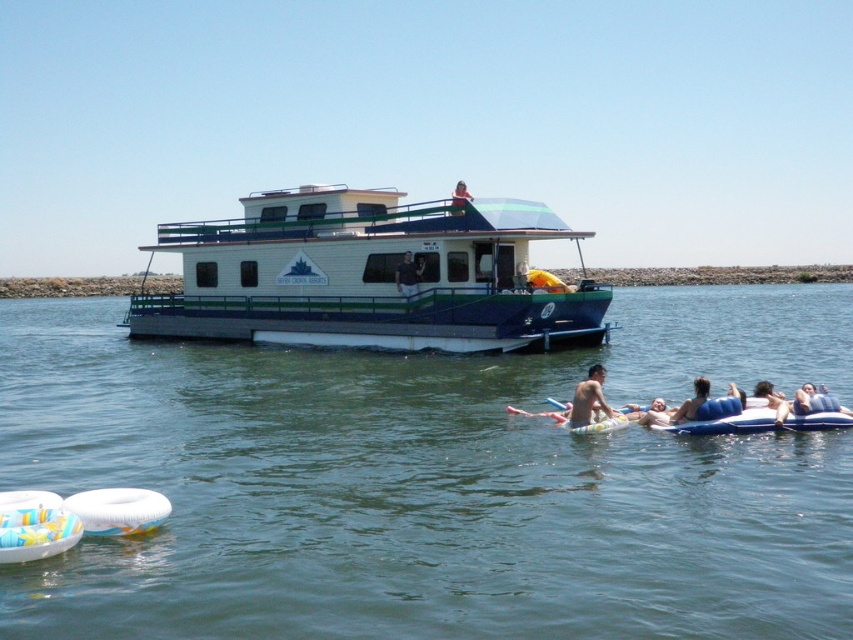
Question: Among these objects, which one is nearest to the camera?

Choices:
 (A) blue rubber ring at lower right
 (B) green smooth water at center

Answer: (B)

Question: Is white fabric shirt at center smaller than smooth tan skin at upper center?

Choices:
 (A) yes
 (B) no

Answer: (A)

Question: Does green smooth water at center appear on the right side of white glossy houseboat at center?

Choices:
 (A) yes
 (B) no

Answer: (B)

Question: Among these points, which one is nearest to the camera?

Choices:
 (A) (584, 387)
 (B) (675, 417)
 (C) (408, 282)

Answer: (B)

Question: In this image, where is green smooth water at center located relative to skinny man at center?

Choices:
 (A) right
 (B) left

Answer: (B)

Question: Which point is closer to the camera taking this photo?

Choices:
 (A) (x=370, y=522)
 (B) (x=584, y=419)
 (C) (x=399, y=284)

Answer: (A)